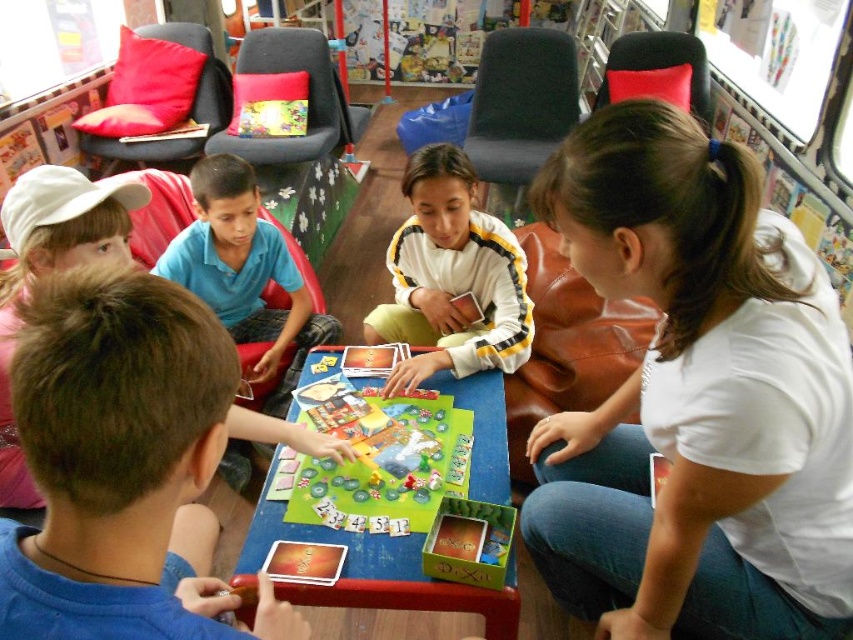
Question: Does white fleece sweater at center come behind white cap at upper left?

Choices:
 (A) yes
 (B) no

Answer: (A)

Question: Based on their relative distances, which object is nearer to the white cap at upper left?

Choices:
 (A) white fleece sweater at center
 (B) brown hair at lower left

Answer: (B)

Question: Does brown hair at lower left have a smaller size compared to white cap at upper left?

Choices:
 (A) no
 (B) yes

Answer: (B)

Question: Which point is farther to the camera?

Choices:
 (A) (457, 160)
 (B) (135, 499)
 (C) (120, 228)

Answer: (A)

Question: Considering the real-world distances, which object is closest to the brown hair at lower left?

Choices:
 (A) white fleece sweater at center
 (B) white cap at upper left

Answer: (B)

Question: Can you confirm if white fleece sweater at center is positioned to the right of white cap at upper left?

Choices:
 (A) yes
 (B) no

Answer: (A)